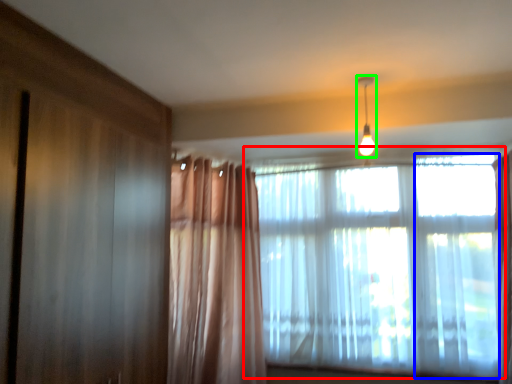
Question: Which object is the closest to the window (highlighted by a red box)? Choose among these: window (highlighted by a blue box) or light fixture (highlighted by a green box).

Choices:
 (A) window
 (B) light fixture

Answer: (A)